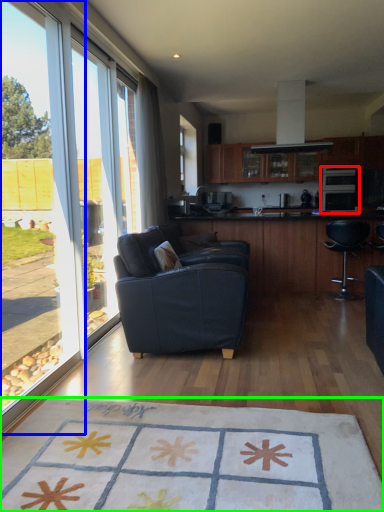
Question: Which object is positioned farthest from appliance (highlighted by a red box)? Select from window (highlighted by a blue box) and mat (highlighted by a green box).

Choices:
 (A) window
 (B) mat

Answer: (B)